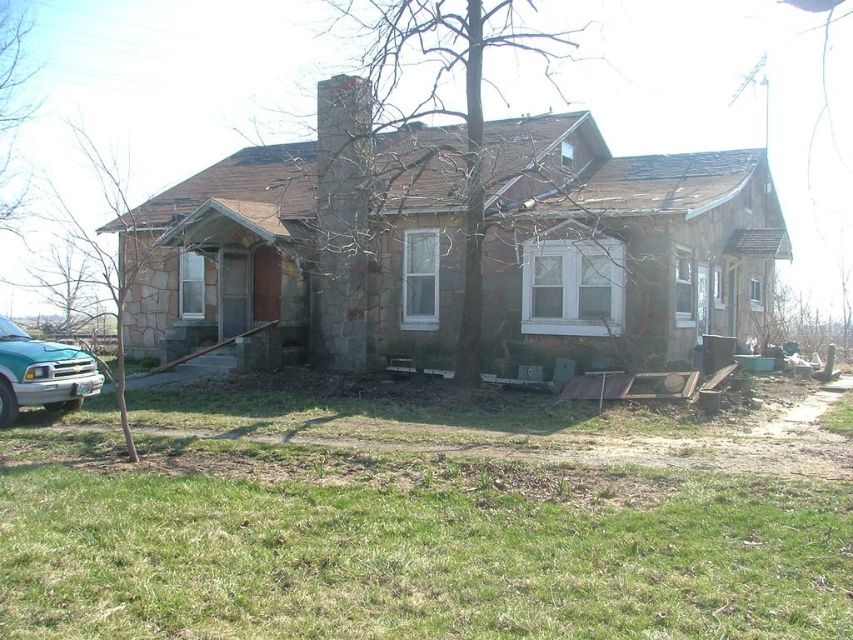
Question: Is green grass at lower center wider than teal metallic truck at lower left?

Choices:
 (A) no
 (B) yes

Answer: (B)

Question: Can you confirm if green grass at lower center is smaller than teal metallic truck at lower left?

Choices:
 (A) no
 (B) yes

Answer: (A)

Question: Which object appears closest to the camera in this image?

Choices:
 (A) green grass at lower center
 (B) teal metallic truck at lower left

Answer: (A)

Question: Which of the following is the farthest from the observer?

Choices:
 (A) green grass at lower center
 (B) teal metallic truck at lower left

Answer: (B)

Question: Does green grass at lower center have a lesser width compared to teal metallic truck at lower left?

Choices:
 (A) yes
 (B) no

Answer: (B)

Question: Which point is closer to the camera taking this photo?

Choices:
 (A) (33, 365)
 (B) (575, 516)

Answer: (B)